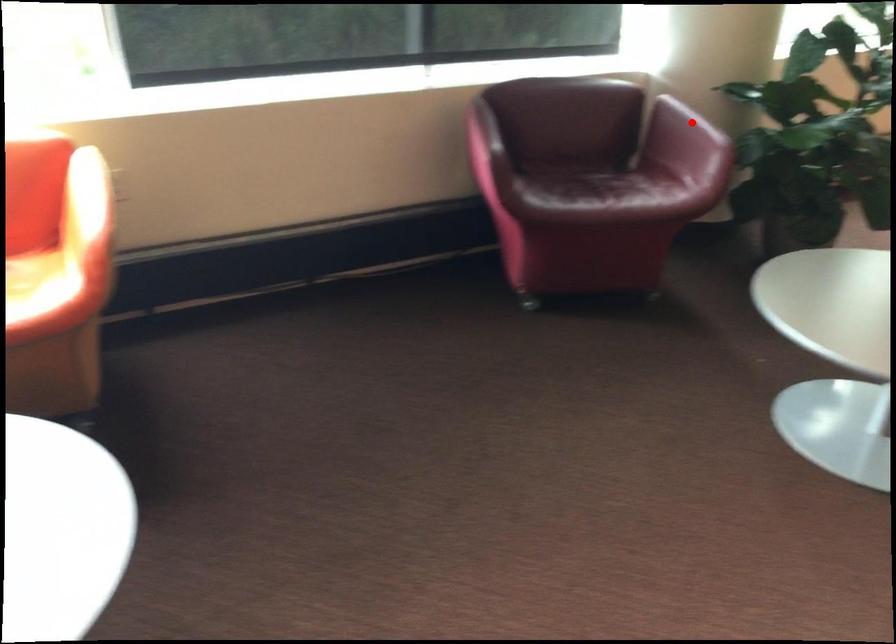
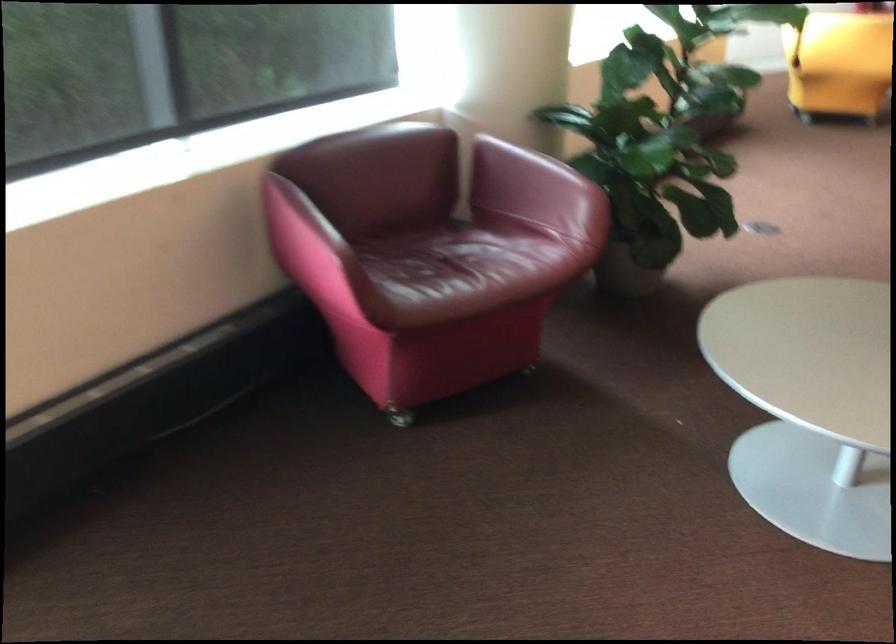
Question: I am providing you with two images of the same scene from different viewpoints. Image1 has a red point marked. In image2, the corresponding 3D location appears at what relative position? Reply with the corresponding letter.

Choices:
 (A) Closer
 (B) Farther

Answer: (A)